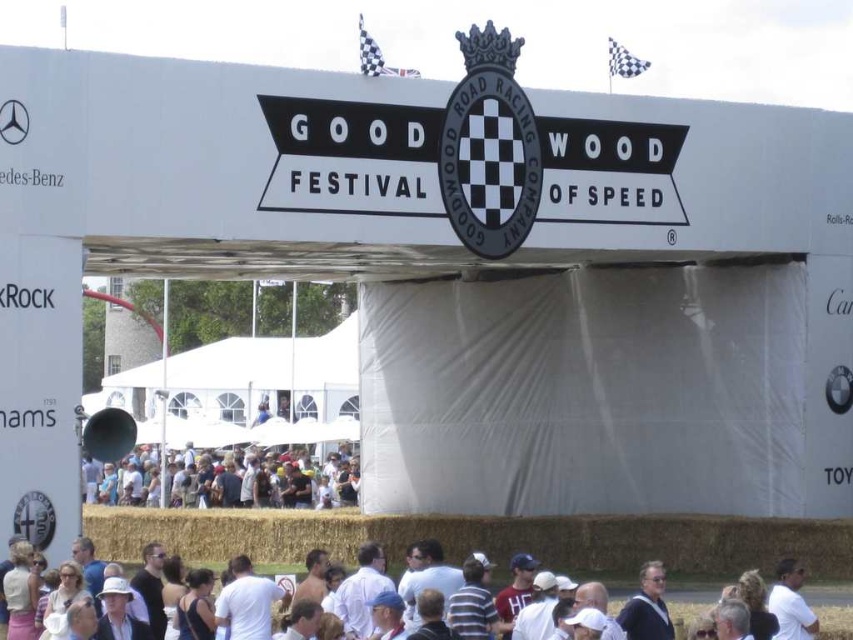
Question: Which point is farther to the camera?

Choices:
 (A) (166, 604)
 (B) (291, 496)

Answer: (B)

Question: Can you confirm if white cotton shirt at lower center is positioned above white cotton crowd at center?

Choices:
 (A) no
 (B) yes

Answer: (B)

Question: Which of the following is the farthest from the observer?

Choices:
 (A) (773, 612)
 (B) (316, 580)

Answer: (B)

Question: Is white cotton shirt at lower center below white cotton crowd at center?

Choices:
 (A) no
 (B) yes

Answer: (A)

Question: Is white cotton crowd at center to the left of white matte shirt at lower right from the viewer's perspective?

Choices:
 (A) yes
 (B) no

Answer: (A)

Question: Which point is closer to the camera?

Choices:
 (A) white cotton shirt at lower center
 (B) white matte shirt at lower right

Answer: (A)